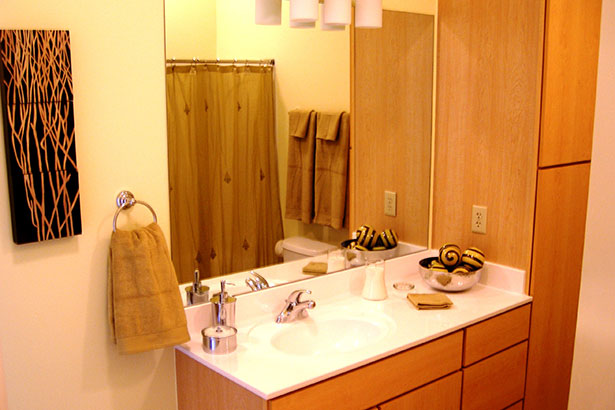
Locate an element on the screen. Image resolution: width=615 pixels, height=410 pixels. sink is located at coordinates (267, 335), (352, 323), (312, 348), (299, 315), (295, 297).